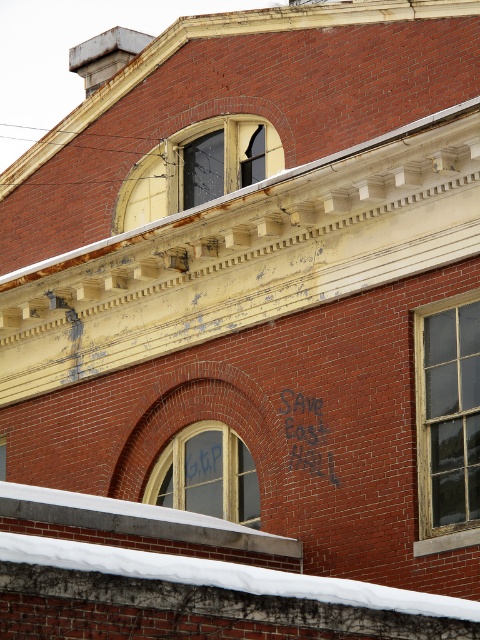
You are an architect inspecting the building. You need to replace the dark glass window at upper center and the wooden window at center. Which window requires a smaller piece of glass?

The dark glass window at upper center requires a smaller piece of glass since it has a smaller size compared to the wooden window at center.

You are an architect inspecting a building. You notice the dark glass window at upper center and the wooden window at center. Which window has a greater height?

The wooden window at center has a greater height than the dark glass window at upper center.

You are an architect evaluating the structural integrity of the building. You notice the dark glass window at upper center and the wooden window at center. Which window has a smaller width?

The dark glass window at upper center has a lesser width compared to the wooden window at center, so the dark glass window at upper center is smaller in width.